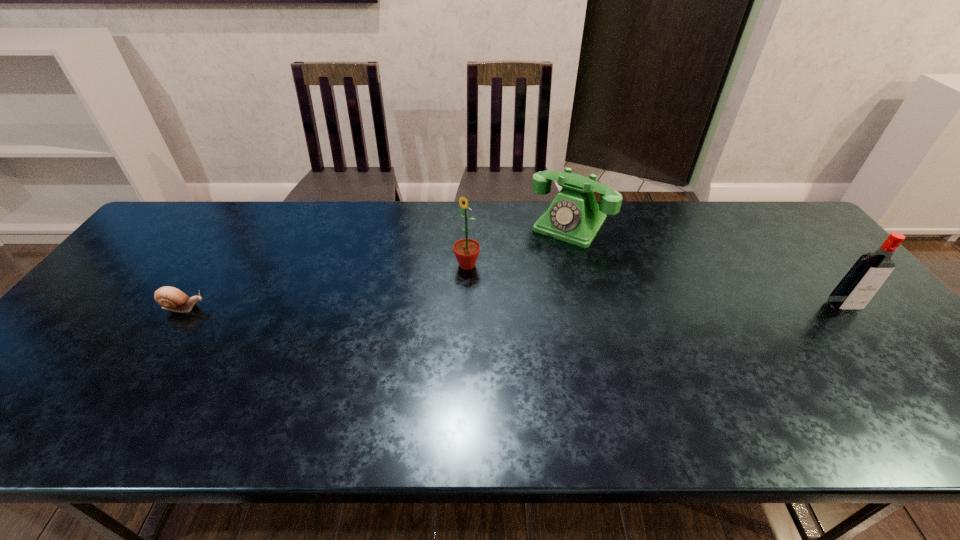
The height and width of the screenshot is (540, 960). Identify the location of the shortest object. (170, 298).

Where is `escargot`? The image size is (960, 540). escargot is located at coordinates (170, 298).

Where is `vodka`? This screenshot has width=960, height=540. vodka is located at coordinates (862, 281).

Locate an element on the screen. This screenshot has height=540, width=960. the farthest object is located at coordinates (574, 216).

The width and height of the screenshot is (960, 540). Identify the location of telephone. (574, 216).

The height and width of the screenshot is (540, 960). Find the location of `the third nearest object`. the third nearest object is located at coordinates (466, 251).

Where is `the second object from left to right`? the second object from left to right is located at coordinates (466, 251).

I want to click on vacant area located 0.350m on the front-facing side of the shortest object, so click(341, 308).

Find the location of `free space located on the front and back of the vodka`. free space located on the front and back of the vodka is located at coordinates (909, 388).

At what (x,y) coordinates should I click in order to perform the action: click on vacant space located on the dial of the third tallest object. Please return your answer as a coordinate pair (x, y). Image resolution: width=960 pixels, height=540 pixels. Looking at the image, I should click on (505, 315).